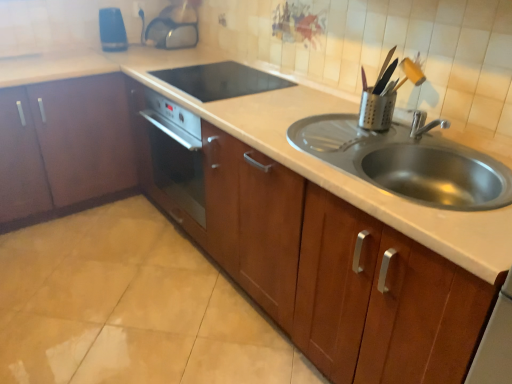
Measure the distance between metallic silver utensil holder at upper right, which is the 4th appliance in left-to-right order, and camera.

The depth of metallic silver utensil holder at upper right, which is the 4th appliance in left-to-right order, is 4.91 feet.

From the picture: Measure the distance between point (190,27) and camera.

8.48 feet.

The width and height of the screenshot is (512, 384). What do you see at coordinates (220, 80) in the screenshot?
I see `black glass cooktop at center, the second appliance viewed from the front` at bounding box center [220, 80].

The height and width of the screenshot is (384, 512). Identify the location of blue plastic electric outlet at upper center. 137,10.

Find the location of a particular element. metallic silver utensil holder at upper right, acting as the first appliance starting from the front is located at coordinates (377, 108).

Can you confirm if transparent plastic kettle at upper center, the second appliance when ordered from left to right, is smaller than blue plastic toaster at upper left, which ranks as the second appliance in back-to-front order?

No, transparent plastic kettle at upper center, the second appliance when ordered from left to right, is not smaller than blue plastic toaster at upper left, which ranks as the second appliance in back-to-front order.

Which is less distant, (151, 33) or (123, 43)?

The point (123, 43) is closer to the camera.

Is transparent plastic kettle at upper center, the third appliance viewed from the right, looking in the opposite direction of blue plastic toaster at upper left, which ranks as the fourth appliance in right-to-left order?

No.

Can you tell me how much transparent plastic kettle at upper center, placed as the fourth appliance when sorted from front to back, and blue plastic toaster at upper left, which is the 3th appliance from front to back, differ in facing direction?

The facing directions of transparent plastic kettle at upper center, placed as the fourth appliance when sorted from front to back, and blue plastic toaster at upper left, which is the 3th appliance from front to back, are 86.4 degrees apart.

Which object is positioned more to the left, blue plastic toaster at upper left, the first appliance viewed from the left, or stainless steel sink at center?

blue plastic toaster at upper left, the first appliance viewed from the left, is more to the left.

Between point (101, 18) and point (466, 208), which one is positioned behind?

Positioned behind is point (101, 18).

Can stainless steel sink at center be found inside blue plastic toaster at upper left, which ranks as the fourth appliance in right-to-left order?

That's incorrect, stainless steel sink at center is not inside blue plastic toaster at upper left, which ranks as the fourth appliance in right-to-left order.

From a real-world perspective, is blue plastic toaster at upper left, which ranks as the fourth appliance in right-to-left order, positioned above or below stainless steel sink at center?

Clearly, from a real-world perspective, blue plastic toaster at upper left, which ranks as the fourth appliance in right-to-left order, is above stainless steel sink at center.

Consider the image. Does matte wood cabinet at left, the 2th cabinetry from the right, have a greater height compared to wooden cabinet at center, the 2th cabinetry positioned from the left?

No.

In terms of size, does matte wood cabinet at left, the first cabinetry viewed from the left, appear bigger or smaller than wooden cabinet at center, which is counted as the 1th cabinetry, starting from the right?

Considering their sizes, matte wood cabinet at left, the first cabinetry viewed from the left, takes up less space than wooden cabinet at center, which is counted as the 1th cabinetry, starting from the right.

Is matte wood cabinet at left, the first cabinetry viewed from the left, turned away from wooden cabinet at center, which is counted as the 1th cabinetry, starting from the right?

No, wooden cabinet at center, which is counted as the 1th cabinetry, starting from the right, is not at the back of matte wood cabinet at left, the first cabinetry viewed from the left.

In the scene shown: Is matte wood cabinet at left, the first cabinetry viewed from the left, touching wooden cabinet at center, which is counted as the 1th cabinetry, starting from the right?

No, matte wood cabinet at left, the first cabinetry viewed from the left, is not beside wooden cabinet at center, which is counted as the 1th cabinetry, starting from the right.

From the image's perspective, is stainless steel sink at center beneath black glass cooktop at center, which is the 3th appliance in left-to-right order?

Yes, from the image's perspective, stainless steel sink at center is below black glass cooktop at center, which is the 3th appliance in left-to-right order.

Is stainless steel sink at center to the right of black glass cooktop at center, which is the 3th appliance in left-to-right order, from the viewer's perspective?

Yes.

Is stainless steel sink at center wider than black glass cooktop at center, the second appliance viewed from the front?

No.

Considering the sizes of stainless steel sink at center and black glass cooktop at center, which is counted as the 3th appliance, starting from the back, in the image, is stainless steel sink at center bigger or smaller than black glass cooktop at center, which is counted as the 3th appliance, starting from the back,?

Clearly, stainless steel sink at center is larger in size than black glass cooktop at center, which is counted as the 3th appliance, starting from the back.

Which object is closer to the camera taking this photo, metallic silver utensil holder at upper right, which is the 4th appliance in left-to-right order, or transparent plastic kettle at upper center, placed as the fourth appliance when sorted from front to back?

metallic silver utensil holder at upper right, which is the 4th appliance in left-to-right order, is closer to the camera.

Can you confirm if metallic silver utensil holder at upper right, acting as the first appliance starting from the front, is taller than transparent plastic kettle at upper center, the second appliance when ordered from left to right?

In fact, metallic silver utensil holder at upper right, acting as the first appliance starting from the front, may be shorter than transparent plastic kettle at upper center, the second appliance when ordered from left to right.

Between metallic silver utensil holder at upper right, acting as the first appliance starting from the front, and transparent plastic kettle at upper center, the third appliance viewed from the right, which one has smaller size?

Smaller between the two is metallic silver utensil holder at upper right, acting as the first appliance starting from the front.

Between point (139, 11) and point (213, 93), which one is positioned in front?

The point (213, 93) is more forward.

At what (x,y) coordinates should I click in order to perform the action: click on electric outlet above the black glass cooktop at center, which ranks as the 2th appliance in right-to-left order (from a real-world perspective). Please return your answer as a coordinate pair (x, y). This screenshot has height=384, width=512. Looking at the image, I should click on (x=137, y=10).

Considering the sizes of blue plastic electric outlet at upper center and black glass cooktop at center, the second appliance viewed from the front, in the image, is blue plastic electric outlet at upper center bigger or smaller than black glass cooktop at center, the second appliance viewed from the front,?

Clearly, blue plastic electric outlet at upper center is smaller in size than black glass cooktop at center, the second appliance viewed from the front.

Would you say blue plastic electric outlet at upper center is to the left or to the right of black glass cooktop at center, the second appliance viewed from the front, in the picture?

From the image, it's evident that blue plastic electric outlet at upper center is to the left of black glass cooktop at center, the second appliance viewed from the front.

Is black glass cooktop at center, which ranks as the 2th appliance in right-to-left order, looking in the opposite direction of matte wood cabinet at left, the first cabinetry viewed from the left?

A: No.

From a real-world perspective, which object stands above the other?

In real-world perspective, black glass cooktop at center, the second appliance viewed from the front, is above.

From the picture: Can you confirm if black glass cooktop at center, which is counted as the 3th appliance, starting from the back, is smaller than matte wood cabinet at left, the 2th cabinetry from the right?

Correct, black glass cooktop at center, which is counted as the 3th appliance, starting from the back, occupies less space than matte wood cabinet at left, the 2th cabinetry from the right.

How different are the orientations of black glass cooktop at center, the second appliance viewed from the front, and matte wood cabinet at left, the first cabinetry viewed from the left, in degrees?

They differ by 88.8 degrees in their facing directions.

Find the location of a particular element. This screenshot has width=512, height=384. appliance behind the blue plastic toaster at upper left, which ranks as the second appliance in back-to-front order is located at coordinates (174, 27).

Find the location of `sink on the right of blue plastic toaster at upper left, the first appliance viewed from the left`. sink on the right of blue plastic toaster at upper left, the first appliance viewed from the left is located at coordinates (407, 163).

Which object lies further to the anchor point blue plastic electric outlet at upper center, metallic silver utensil holder at upper right, the fourth appliance in the back-to-front sequence, or blue plastic toaster at upper left, which ranks as the fourth appliance in right-to-left order?

metallic silver utensil holder at upper right, the fourth appliance in the back-to-front sequence.

From the image, which object appears to be nearer to matte wood cabinet at left, the first cabinetry viewed from the left, blue plastic toaster at upper left, which ranks as the fourth appliance in right-to-left order, or black glass cooktop at center, which is counted as the 3th appliance, starting from the back?

The object closer to matte wood cabinet at left, the first cabinetry viewed from the left, is blue plastic toaster at upper left, which ranks as the fourth appliance in right-to-left order.

Based on their spatial positions, is blue plastic electric outlet at upper center or stainless steel sink at center closer to wooden cabinet at center, the 2th cabinetry positioned from the left?

stainless steel sink at center.

From the image, which object appears to be nearer to matte wood cabinet at left, the 2th cabinetry from the right, transparent plastic kettle at upper center, the third appliance viewed from the right, or metallic silver utensil holder at upper right, which is the 4th appliance in left-to-right order?

The object closer to matte wood cabinet at left, the 2th cabinetry from the right, is transparent plastic kettle at upper center, the third appliance viewed from the right.

Looking at the image, which one is located closer to blue plastic electric outlet at upper center, blue plastic toaster at upper left, which is the 3th appliance from front to back, or stainless steel sink at center?

Among the two, blue plastic toaster at upper left, which is the 3th appliance from front to back, is located nearer to blue plastic electric outlet at upper center.

In the scene shown: Based on their spatial positions, is blue plastic toaster at upper left, which ranks as the second appliance in back-to-front order, or metallic silver utensil holder at upper right, which is the 4th appliance in left-to-right order, further from stainless steel sink at center?

blue plastic toaster at upper left, which ranks as the second appliance in back-to-front order, is further to stainless steel sink at center.

From the image, which object appears to be farther from blue plastic toaster at upper left, which is the 3th appliance from front to back, blue plastic electric outlet at upper center or stainless steel sink at center?

stainless steel sink at center lies further to blue plastic toaster at upper left, which is the 3th appliance from front to back, than the other object.

Which object lies nearer to the anchor point wooden cabinet at center, which is counted as the 1th cabinetry, starting from the right, blue plastic toaster at upper left, which ranks as the second appliance in back-to-front order, or black glass cooktop at center, which ranks as the 2th appliance in right-to-left order?

Based on the image, black glass cooktop at center, which ranks as the 2th appliance in right-to-left order, appears to be nearer to wooden cabinet at center, which is counted as the 1th cabinetry, starting from the right.

This screenshot has width=512, height=384. In order to click on cabinetry between matte wood cabinet at left, the 2th cabinetry from the right, and metallic silver utensil holder at upper right, acting as the first appliance starting from the right in this screenshot , I will do `click(338, 274)`.

The image size is (512, 384). What are the coordinates of `sink between wooden cabinet at center, which is counted as the 1th cabinetry, starting from the right, and black glass cooktop at center, the second appliance viewed from the front, in the front-back direction` in the screenshot? It's located at (407, 163).

Locate an element on the screen. The height and width of the screenshot is (384, 512). sink between wooden cabinet at center, which is counted as the 1th cabinetry, starting from the right, and blue plastic toaster at upper left, which ranks as the fourth appliance in right-to-left order, in the front-back direction is located at coordinates (407, 163).

Where is `sink between wooden cabinet at center, which is counted as the 1th cabinetry, starting from the right, and blue plastic electric outlet at upper center from front to back`? sink between wooden cabinet at center, which is counted as the 1th cabinetry, starting from the right, and blue plastic electric outlet at upper center from front to back is located at coordinates (407, 163).